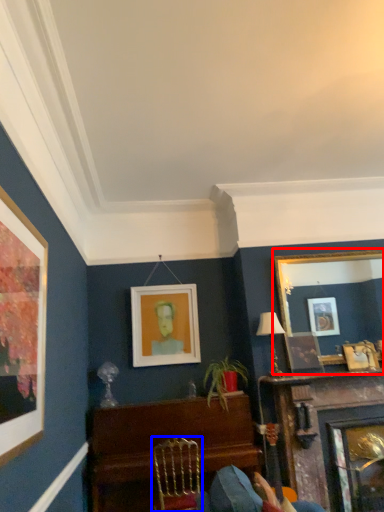
Question: Which of the following is the farthest to the observer, picture frame (highlighted by a red box) or chair (highlighted by a blue box)?

Choices:
 (A) picture frame
 (B) chair

Answer: (A)